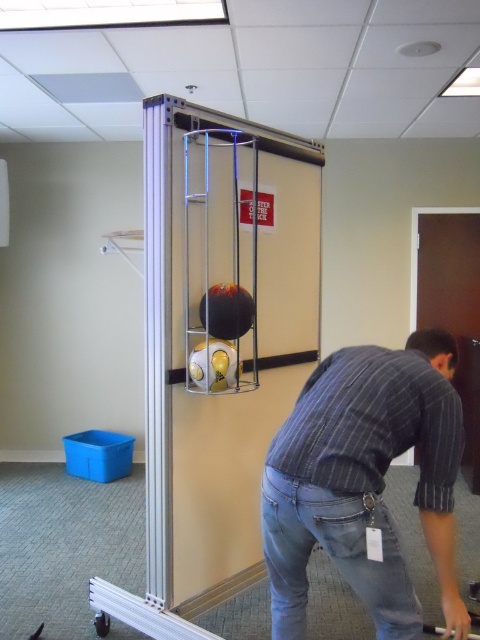
Is the position of blue denim jeans at lower center more distant than that of shiny orange bowling ball at center?

That is False.

Which is in front, point (328, 518) or point (217, 364)?

Point (328, 518) is more forward.

Identify the location of blue denim jeans at lower center. (332, 556).

Which is behind, point (217, 307) or point (223, 358)?

Point (217, 307)

Does shiny black bowling ball at center appear over shiny orange bowling ball at center?

Indeed, shiny black bowling ball at center is positioned over shiny orange bowling ball at center.

Does point (217, 317) come closer to viewer compared to point (217, 339)?

That is True.

Image resolution: width=480 pixels, height=640 pixels. I want to click on shiny black bowling ball at center, so click(227, 310).

Based on the photo, who is positioned more to the right, blue denim jeans at lower center or shiny black bowling ball at center?

From the viewer's perspective, blue denim jeans at lower center appears more on the right side.

Can you confirm if blue denim jeans at lower center is shorter than shiny black bowling ball at center?

No, blue denim jeans at lower center is not shorter than shiny black bowling ball at center.

Does point (382, 608) come farther from viewer compared to point (225, 301)?

No, it is not.

Locate an element on the screen. blue denim jeans at lower center is located at coordinates click(332, 556).